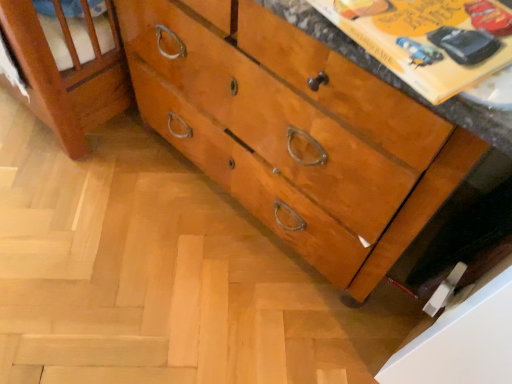
This screenshot has width=512, height=384. Find the location of `free location above yellow paper at upper right (from a real-world perspective)`. free location above yellow paper at upper right (from a real-world perspective) is located at coordinates (445, 21).